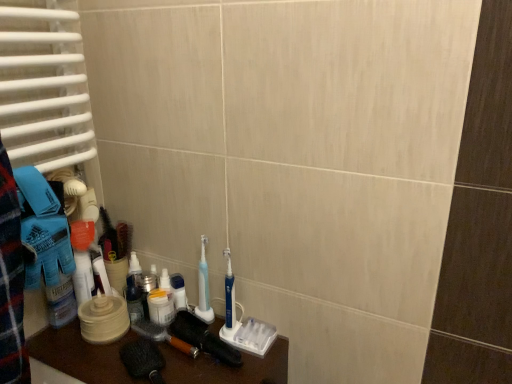
Question: Is blue plastic toothbrush at center, which ranks as the second toothbrush in left-to-right order, to the left or to the right of dark brown wooden brush at lower left, which appears as the second brush when viewed from the right, in the image?

Choices:
 (A) left
 (B) right

Answer: (B)

Question: Is point (226, 307) closer or farther from the camera than point (192, 349)?

Choices:
 (A) farther
 (B) closer

Answer: (A)

Question: Estimate the real-world distances between objects in this image. Which object is closer to the blue plastic toothbrush at center, acting as the first toothbrush starting from the right?

Choices:
 (A) dark brown wooden brush at lower left, which appears as the second brush when viewed from the right
 (B) blue plastic toothbrush at center, the 2th toothbrush in the right-to-left sequence
 (C) white plastic radiator at left
 (D) black rubber brush at lower center, which appears as the first brush when viewed from the right
 (E) white plastic toothbrushes at lower left

Answer: (B)

Question: Which object is the closest to the translucent plastic container at center, the 1th toiletry when ordered from left to right?

Choices:
 (A) blue plastic toothbrush at center, the 2th toothbrush in the right-to-left sequence
 (B) dark brown wooden brush at lower left, positioned as the 1th brush in left-to-right order
 (C) white plastic container at center, the second toiletry viewed from the left
 (D) blue plastic toothbrush at center, which ranks as the second toothbrush in left-to-right order
 (E) white plastic radiator at left

Answer: (B)